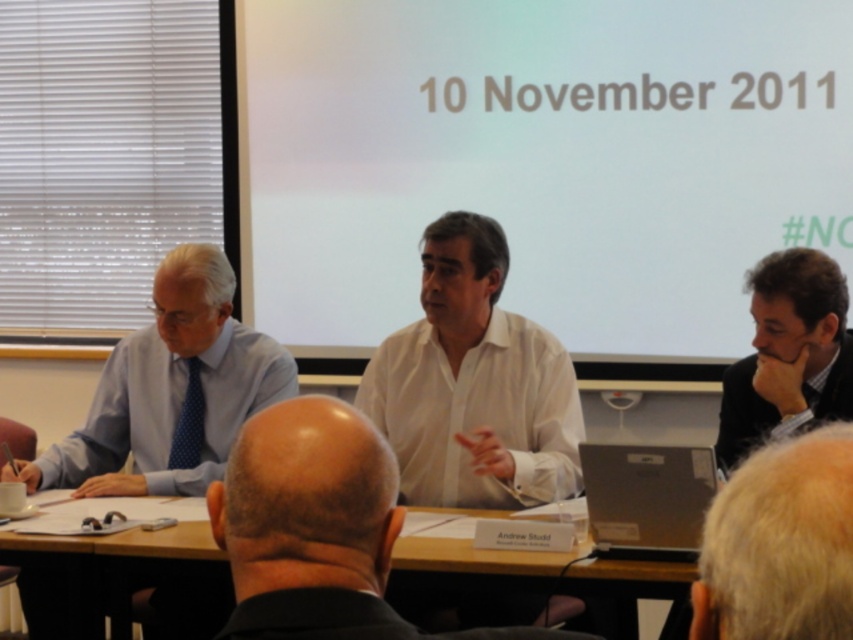
Does gray hair at upper center lie behind dark brown hair at right?

No, it is not.

Can you confirm if gray hair at upper center is bigger than dark brown hair at right?

Incorrect, gray hair at upper center is not larger than dark brown hair at right.

You are a GUI agent. You are given a task and a screenshot of the screen. Output one action in this format:
    pyautogui.click(x=<x>, y=<y>)
    Task: Click on the gray hair at upper center
    This screenshot has height=640, width=853.
    Given the screenshot: What is the action you would take?
    pyautogui.click(x=780, y=545)

Image resolution: width=853 pixels, height=640 pixels. I want to click on gray hair at upper center, so click(x=780, y=545).

Does gray hair at upper center appear on the right side of wooden table at center?

Indeed, gray hair at upper center is positioned on the right side of wooden table at center.

Who is more distant from viewer, (x=752, y=568) or (x=164, y=536)?

Positioned behind is point (x=164, y=536).

Where is `gray hair at upper center`? gray hair at upper center is located at coordinates (780, 545).

Identify the location of white shirt at center. (317, 529).

Is the position of white shirt at center more distant than that of dark brown hair at right?

No, white shirt at center is closer to the viewer.

Does point (289, 588) come behind point (767, 384)?

No, it is not.

The height and width of the screenshot is (640, 853). I want to click on white shirt at center, so point(317,529).